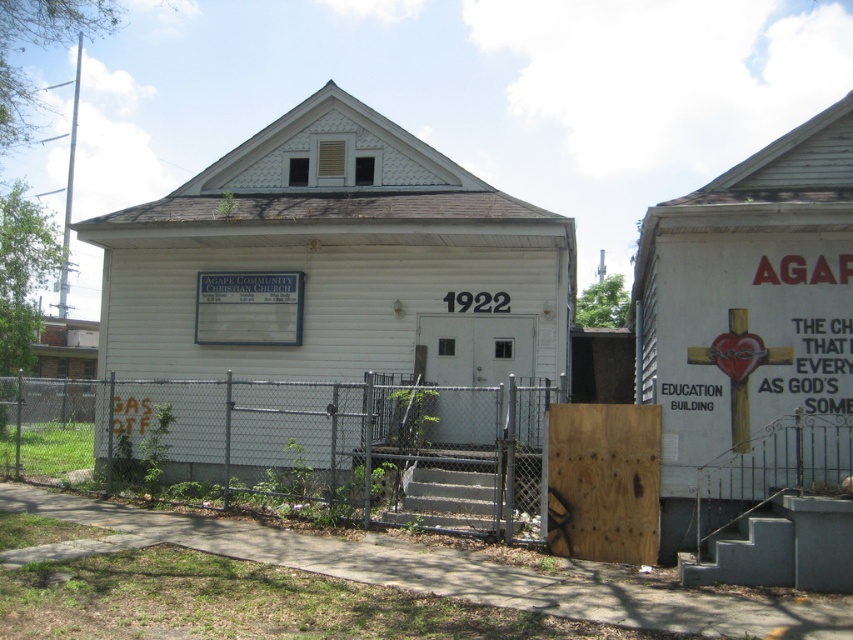
This screenshot has height=640, width=853. Describe the element at coordinates (248, 307) in the screenshot. I see `white matte sign at center` at that location.

Which is more to the left, white matte sign at center or red painted heart at center?

white matte sign at center

Is point (289, 332) positioned after point (741, 372)?

Yes.

Find the location of a particular element. white matte sign at center is located at coordinates (248, 307).

Can you confirm if gray chain-link fence at lower left is smaller than white matte sign at center?

No, gray chain-link fence at lower left is not smaller than white matte sign at center.

Locate an element on the screen. gray chain-link fence at lower left is located at coordinates (296, 448).

What are the coordinates of `gray chain-link fence at lower left` in the screenshot? It's located at (296, 448).

Is point (415, 442) less distant than point (735, 381)?

No, it is behind (735, 381).

Is point (55, 465) positioned behind point (741, 372)?

Yes, it is.

Where is `gray chain-link fence at lower left`? The height and width of the screenshot is (640, 853). gray chain-link fence at lower left is located at coordinates (296, 448).